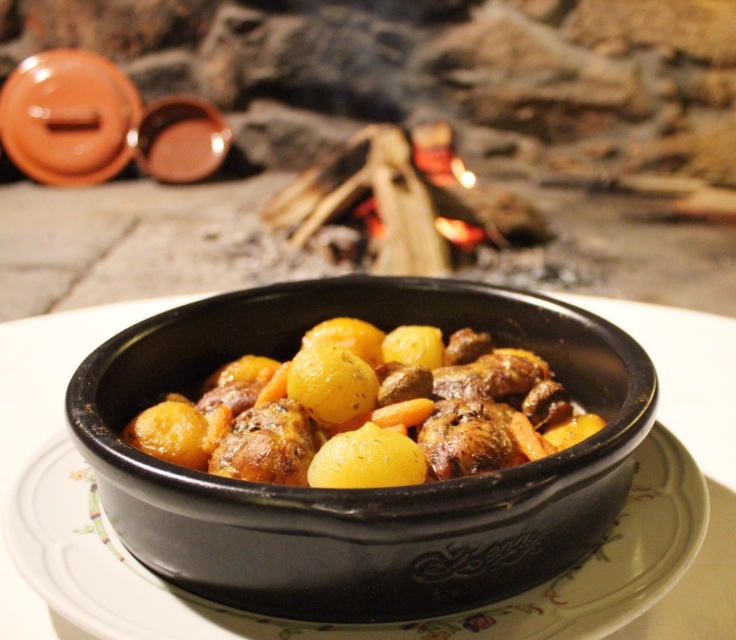
What do you see at coordinates (360, 490) in the screenshot? The width and height of the screenshot is (736, 640). I see `black ceramic bowl at center` at bounding box center [360, 490].

Is black ceramic bowl at center taller than golden brown glazed meat and vegetables at center?

Correct, black ceramic bowl at center is much taller as golden brown glazed meat and vegetables at center.

Which is in front, point (555, 515) or point (215, 416)?

Positioned in front is point (555, 515).

Locate an element on the screen. The height and width of the screenshot is (640, 736). black ceramic bowl at center is located at coordinates pyautogui.click(x=360, y=490).